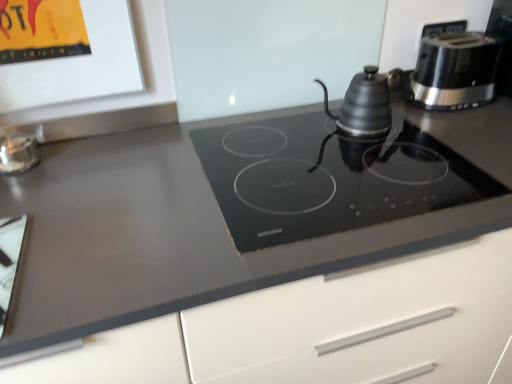
The width and height of the screenshot is (512, 384). What are the coordinates of `free space in front of clear glass jar at left, the 2th appliance from the bottom` in the screenshot? It's located at (31, 190).